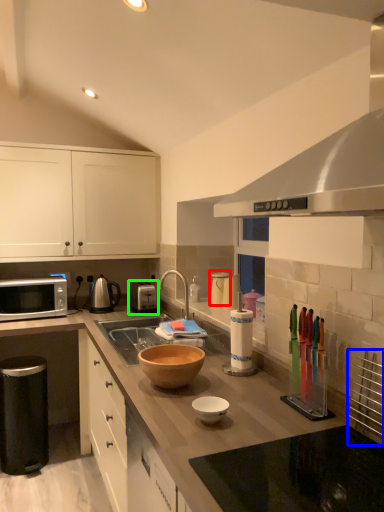
Question: Considering the real-world distances, which object is closest to appliance (highlighted by a red box)? appliance (highlighted by a blue box) or appliance (highlighted by a green box).

Choices:
 (A) appliance
 (B) appliance

Answer: (B)